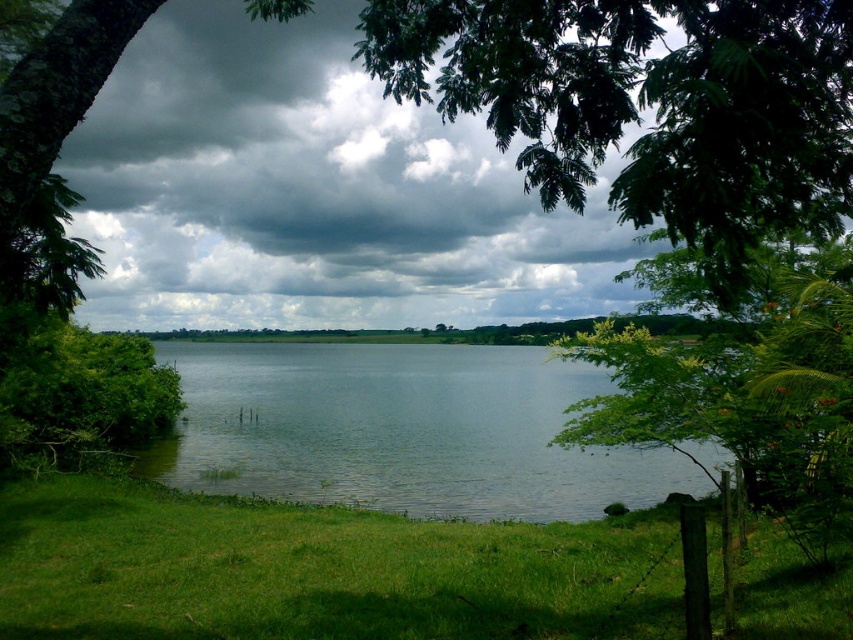
Between green grass at lower left and clear water at center, which one appears on the left side from the viewer's perspective?

clear water at center is more to the left.

Between green grass at lower left and clear water at center, which one appears on the right side from the viewer's perspective?

Positioned to the right is green grass at lower left.

Measure the distance between green grass at lower left and camera.

green grass at lower left is 5.31 meters from camera.

I want to click on green grass at lower left, so click(x=318, y=570).